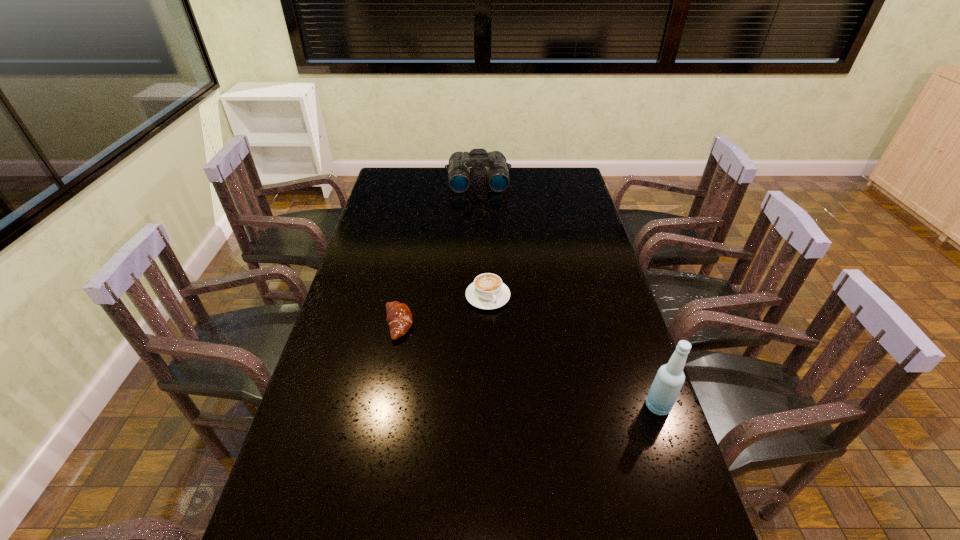
Identify the location of vacant space located through the lenses of the third shortest object. pos(481,213).

Find the location of a particular element. The width and height of the screenshot is (960, 540). free region located 0.220m through the lenses of the third shortest object is located at coordinates (482, 222).

I want to click on vacant space situated 0.170m on the side of the cappuccino with the handle, so tap(517, 350).

You are a GUI agent. You are given a task and a screenshot of the screen. Output one action in this format:
    pyautogui.click(x=<x>, y=<y>)
    Task: Click on the vacant space situated 0.310m on the side of the cappuccino with the handle
    This screenshot has width=960, height=540.
    Given the screenshot: What is the action you would take?
    pyautogui.click(x=539, y=388)

Identify the location of free location located on the side of the cappuccino with the handle. (531, 374).

Where is `object present at the far edge`? object present at the far edge is located at coordinates (498, 178).

The image size is (960, 540). Identify the location of object that is at the left edge. (399, 318).

The width and height of the screenshot is (960, 540). I want to click on object at the right edge, so click(x=670, y=377).

The width and height of the screenshot is (960, 540). In the image, there is a desktop. Find the location of `vacant region at the far edge`. vacant region at the far edge is located at coordinates (448, 188).

This screenshot has height=540, width=960. In the image, there is a desktop. Find the location of `vacant region at the left edge`. vacant region at the left edge is located at coordinates (388, 260).